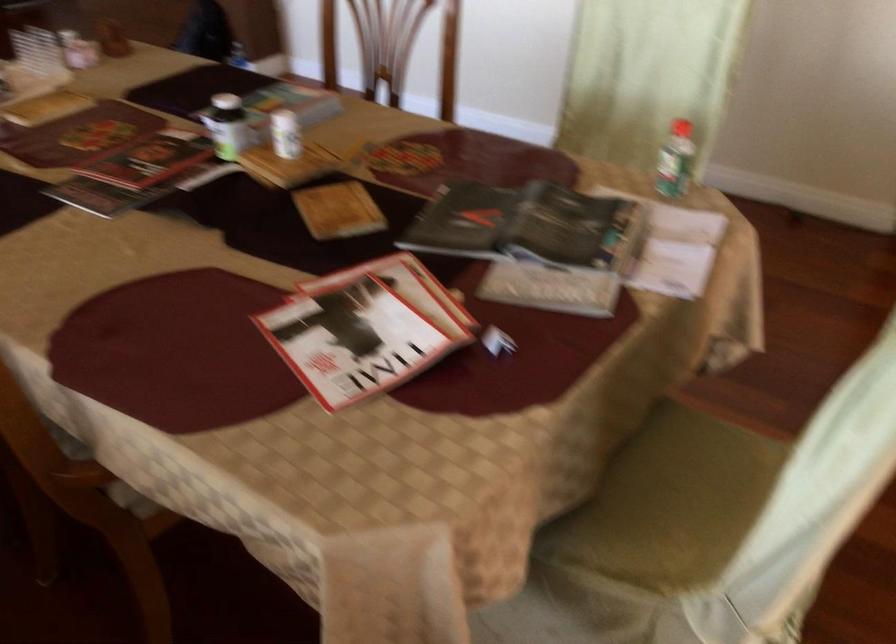
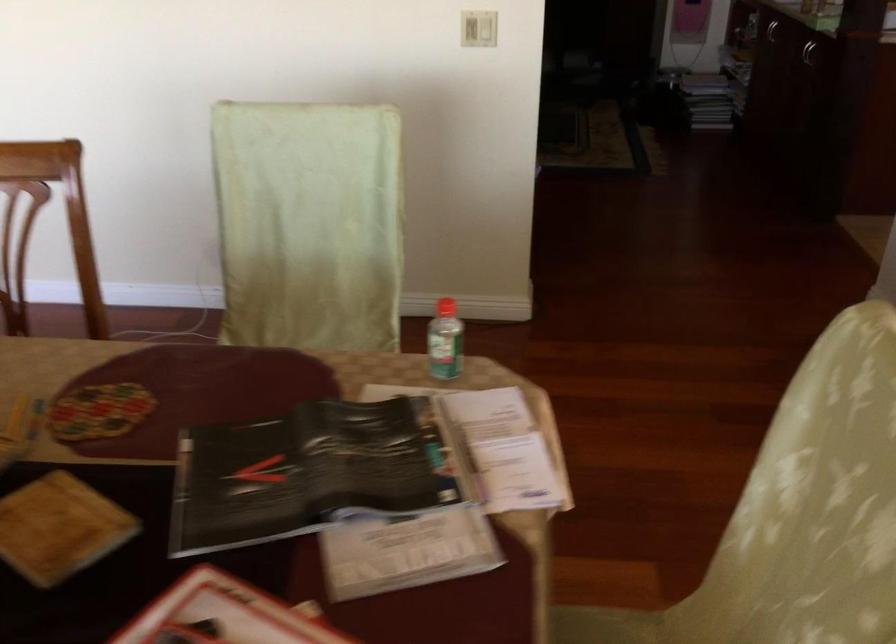
Where in the second image is the point corresponding to (x=728, y=439) from the first image?

(606, 626)